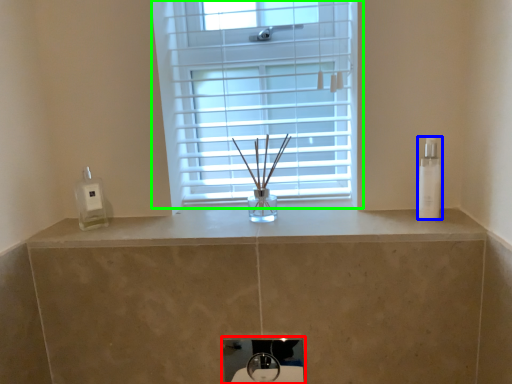
Question: Which is farther away from sink (highlighted by a red box)? toiletry (highlighted by a blue box) or window (highlighted by a green box)?

Choices:
 (A) toiletry
 (B) window

Answer: (A)